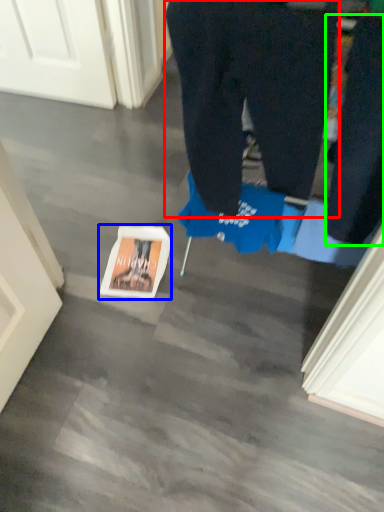
Question: Which object is positioned closest to trousers (highlighted by a red box)? Select from copy (highlighted by a blue box) and pants (highlighted by a green box).

Choices:
 (A) copy
 (B) pants

Answer: (B)